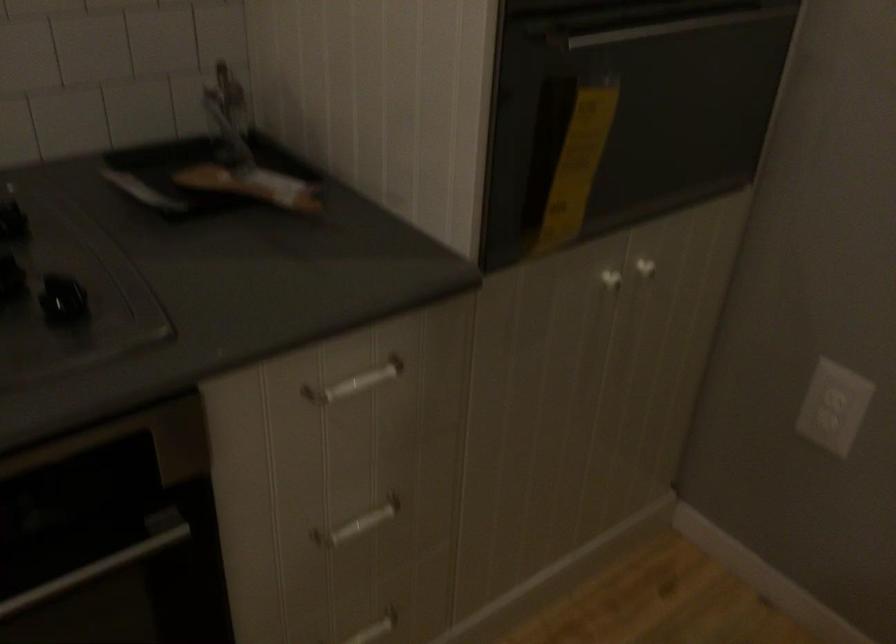
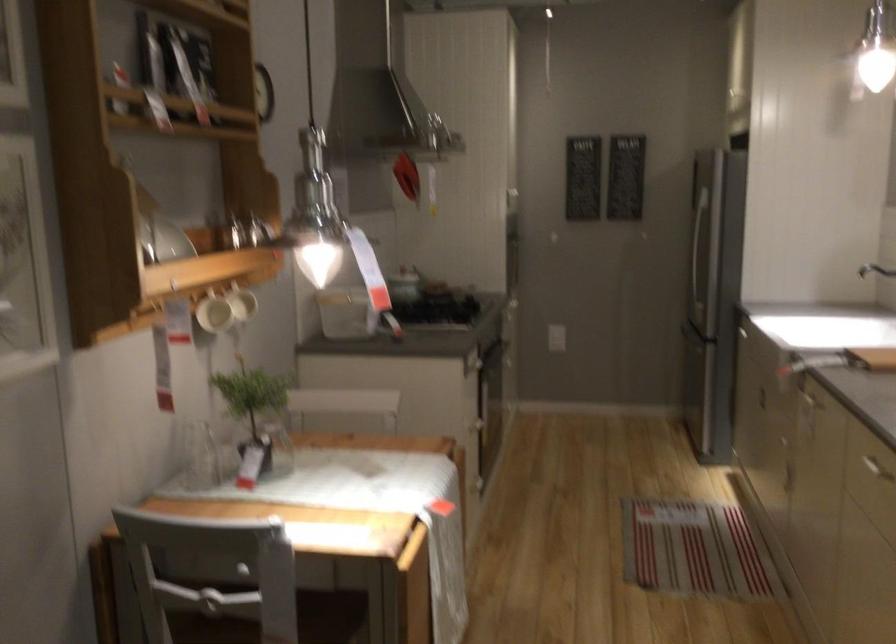
Question: I am providing you with two images of the same scene from different viewpoints. Which of the following objects are not visible in image2?

Choices:
 (A) white drawer handle
 (B) sink faucet handle
 (C) small frameless mirror
 (D) cabinet drawer handle

Answer: (A)